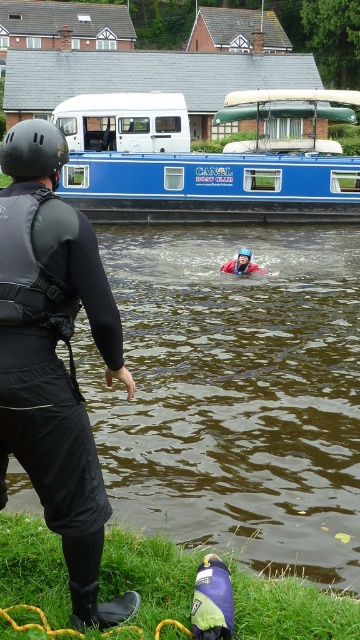
Question: Which point appears farthest from the camera in this image?

Choices:
 (A) (245, 273)
 (B) (239, 355)
 (C) (118, 173)

Answer: (C)

Question: Does black wetsuit at left have a smaller size compared to blue polished wood canal boat at upper center?

Choices:
 (A) no
 (B) yes

Answer: (B)

Question: Is blue polished wood canal boat at upper center positioned in front of red fleece life jacket at center?

Choices:
 (A) yes
 (B) no

Answer: (B)

Question: Is blue polished wood canal boat at upper center positioned behind black matte helmet at upper left?

Choices:
 (A) no
 (B) yes

Answer: (B)

Question: Which of the following is the farthest from the observer?

Choices:
 (A) black wetsuit at left
 (B) black matte helmet at upper left
 (C) blue polished wood canal boat at upper center

Answer: (C)

Question: Which object is farther from the camera taking this photo?

Choices:
 (A) black wetsuit at left
 (B) blue polished wood canal boat at upper center
 (C) red fleece life jacket at center

Answer: (B)